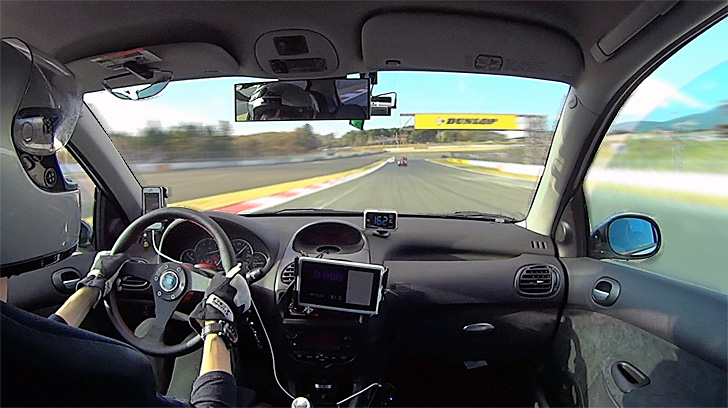
Identify the location of cord. The height and width of the screenshot is (408, 728). (271, 349).